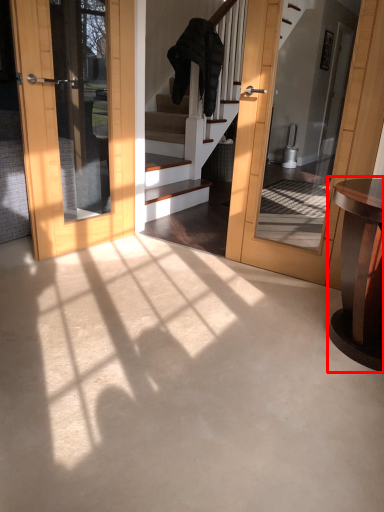
Question: In this image, where is table (annotated by the red box) located relative to robe?

Choices:
 (A) left
 (B) right

Answer: (B)